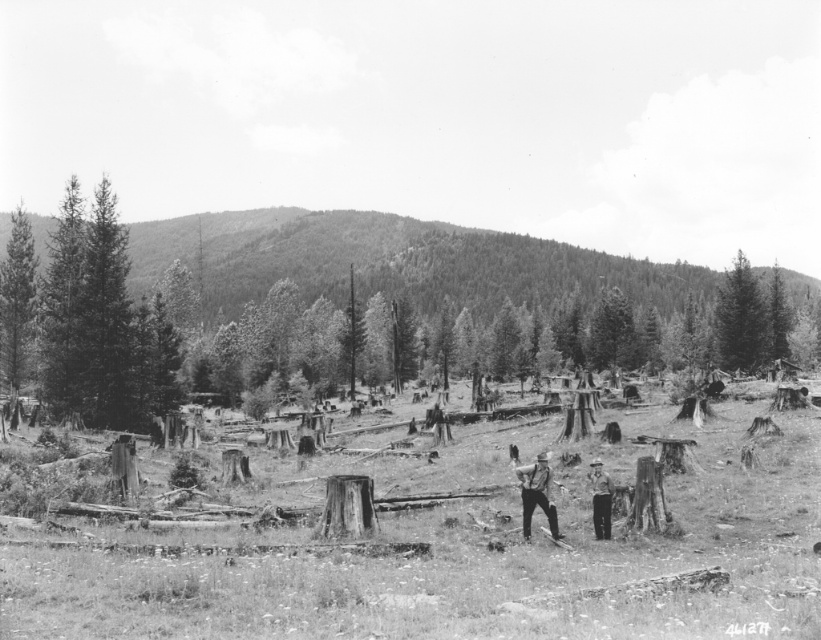
Is smooth green hillside at upper left bigger than matte black overalls at center?

Yes, smooth green hillside at upper left is bigger than matte black overalls at center.

Between point (430, 228) and point (547, 465), which one is positioned behind?

Point (430, 228)

I want to click on smooth green hillside at upper left, so click(391, 260).

Between wooden stumps at center and light brown wooden stick at center, which one has less height?

Standing shorter between the two is light brown wooden stick at center.

At what (x,y) coordinates should I click in order to perform the action: click on wooden stumps at center. Please return your answer as a coordinate pair (x, y). This screenshot has height=640, width=821. Looking at the image, I should click on (453, 556).

Does smooth green tree at upper right have a lesser height compared to light brown wooden stick at center?

In fact, smooth green tree at upper right may be taller than light brown wooden stick at center.

Looking at this image, who is more distant from viewer, (736, 356) or (604, 496)?

The point (736, 356) is more distant.

Between point (764, 314) and point (597, 497), which one is positioned in front?

Point (597, 497)

Identify the location of smooth green tree at upper right. The width and height of the screenshot is (821, 640). (741, 317).